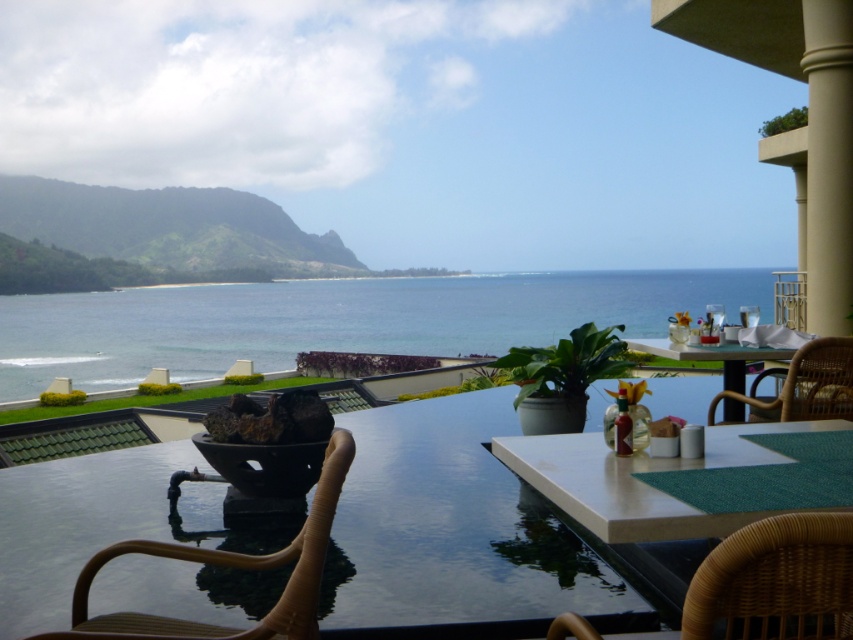
You are planning to seat two guests on the brown wicker chair at lower left and the wicker chair at right. Which chair can accommodate a larger guest due to its size?

The brown wicker chair at lower left can accommodate a larger guest because its width surpasses that of the wicker chair at right.

You are standing on the balcony and want to place a small potted plant exactly at the point marked by the coordinates point (451,525). What object will the potted plant be placed on?

The point (451,525) indicates the smooth stone table at center, so the potted plant will be placed on the smooth stone table at center.